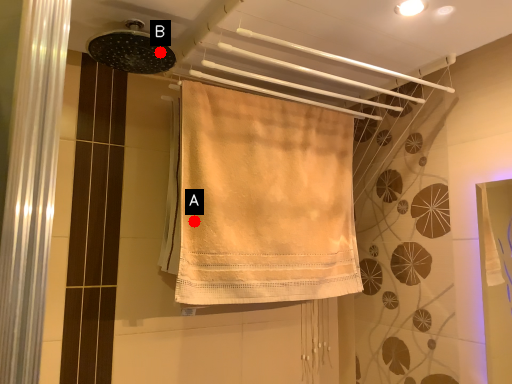
Question: Two points are circled on the image, labeled by A and B beside each circle. Which point appears farthest from the camera in this image?

Choices:
 (A) A is further
 (B) B is further

Answer: (A)